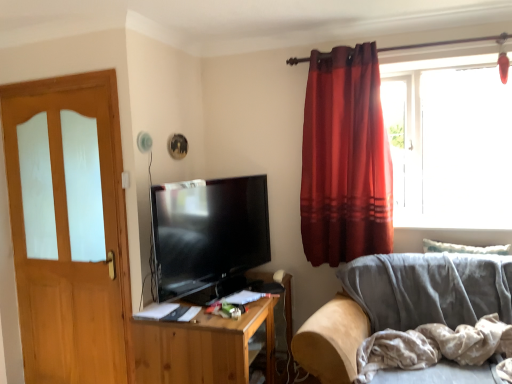
Question: From a real-world perspective, is light gray cotton blanket at lower right physically located above or below transparent glass window at upper right?

Choices:
 (A) above
 (B) below

Answer: (B)

Question: In terms of height, does light gray cotton blanket at lower right look taller or shorter compared to transparent glass window at upper right?

Choices:
 (A) tall
 (B) short

Answer: (B)

Question: Considering the real-world distances, which object is farthest from the light brown wood door at left?

Choices:
 (A) transparent glass window at upper right
 (B) wooden tv stand at center
 (C) velvet red curtain at right
 (D) light gray cotton blanket at lower right
 (E) velvet gray couch at lower right

Answer: (A)

Question: Based on their relative distances, which object is farther from the transparent glass window at upper right?

Choices:
 (A) light brown wood door at left
 (B) wooden tv stand at center
 (C) light gray cotton blanket at lower right
 (D) velvet gray couch at lower right
 (E) matte black tv at center

Answer: (A)